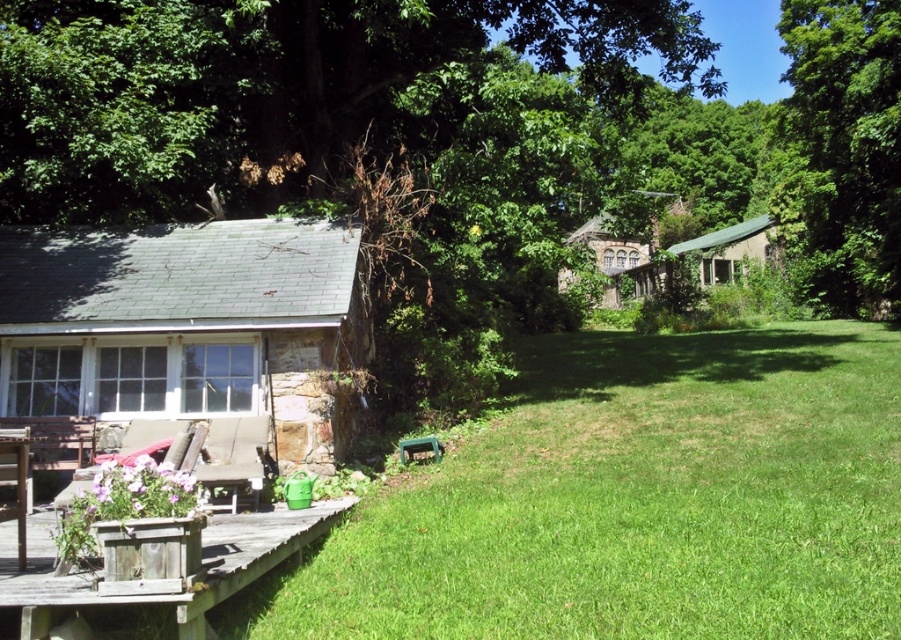
Is rustic stone cottage at center below wooden picnic table at lower left?

No.

Who is more forward, (589, 244) or (17, 490)?

Point (17, 490) is in front.

What do you see at coordinates (616, 257) in the screenshot? This screenshot has height=640, width=901. I see `rustic stone cottage at center` at bounding box center [616, 257].

The width and height of the screenshot is (901, 640). Find the location of `rustic stone cottage at center`. rustic stone cottage at center is located at coordinates (616, 257).

Which is above, rustic stone cottage at center or green corrugated metal cottage at center-right?

green corrugated metal cottage at center-right is higher up.

Based on the photo, is rustic stone cottage at center below green corrugated metal cottage at center-right?

Yes.

Which is behind, point (585, 241) or point (756, 225)?

Point (585, 241)

Find the location of a particular element. The height and width of the screenshot is (640, 901). rustic stone cottage at center is located at coordinates (616, 257).

Does point (256, 307) come behind point (602, 301)?

That is False.

Can you confirm if white stone cottage at left is taller than rustic stone cottage at center?

No.

This screenshot has width=901, height=640. Find the location of `white stone cottage at left`. white stone cottage at left is located at coordinates (187, 328).

The height and width of the screenshot is (640, 901). Find the location of `white stone cottage at left`. white stone cottage at left is located at coordinates (187, 328).